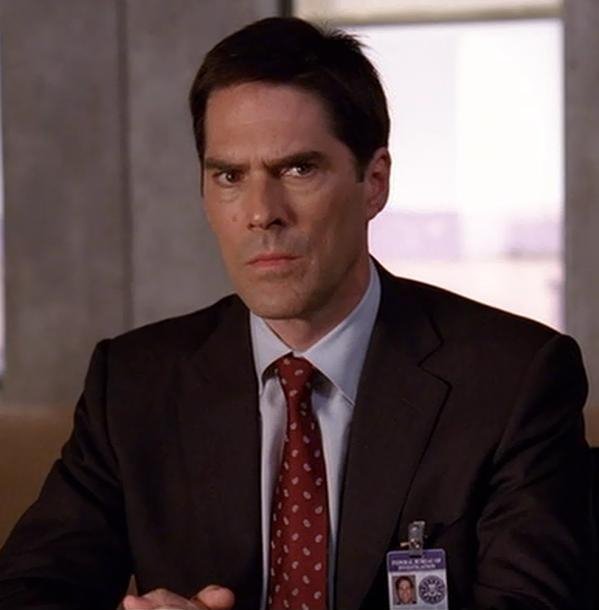
The image size is (599, 610). I want to click on back walls, so click(x=588, y=249), click(x=181, y=232), click(x=55, y=224).